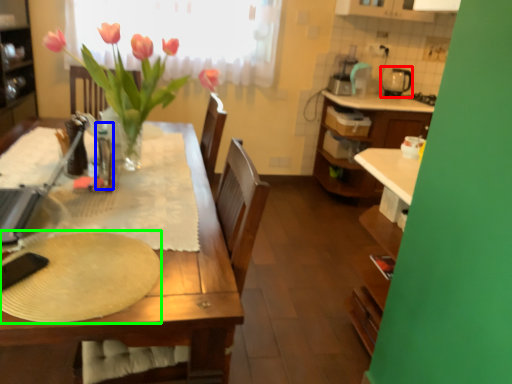
Question: Estimate the real-world distances between objects in this image. Which object is closer to appliance (highlighted by a red box), bottle (highlighted by a blue box) or paper plate (highlighted by a green box)?

Choices:
 (A) bottle
 (B) paper plate

Answer: (A)